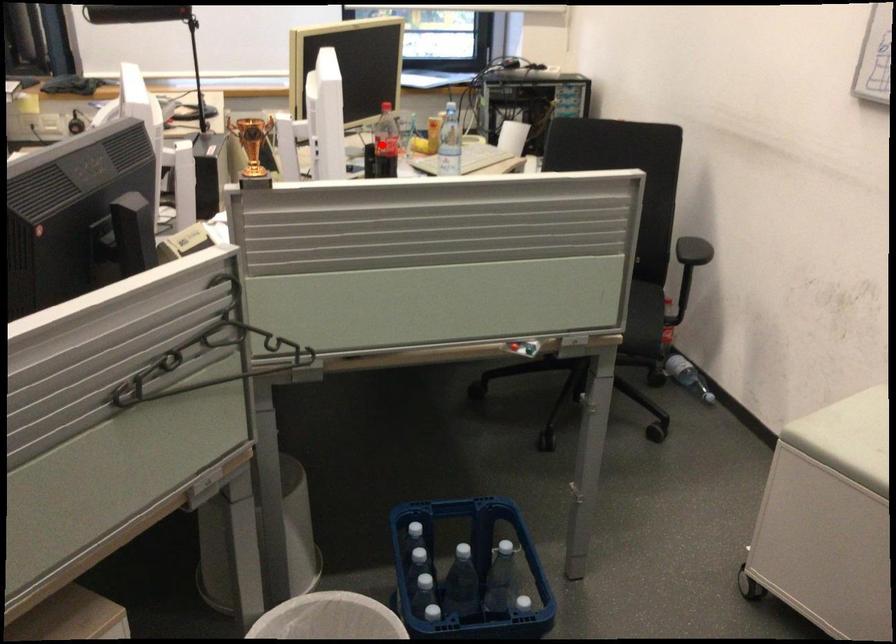
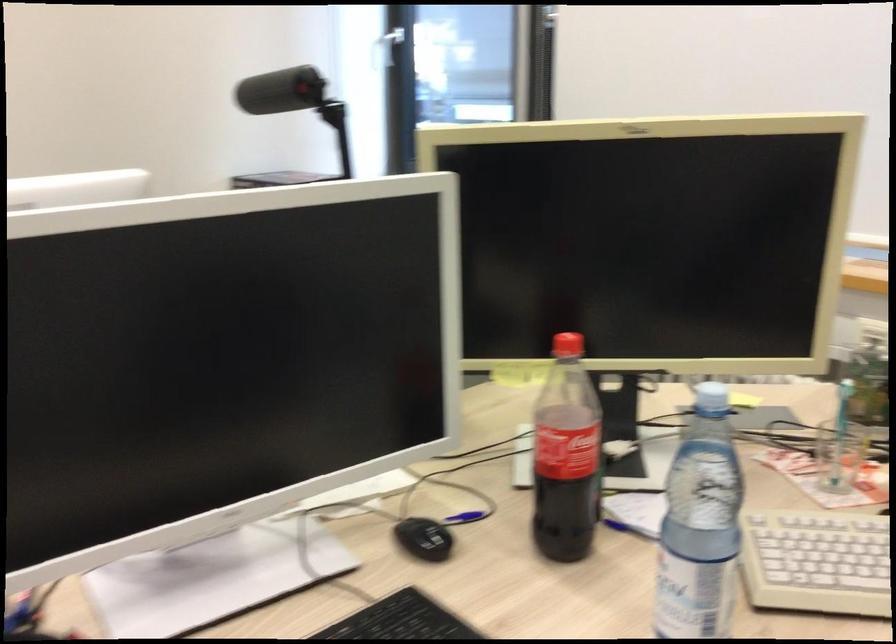
In the second image, find the point that corresponds to the highlighted location in the first image.

(565, 456)